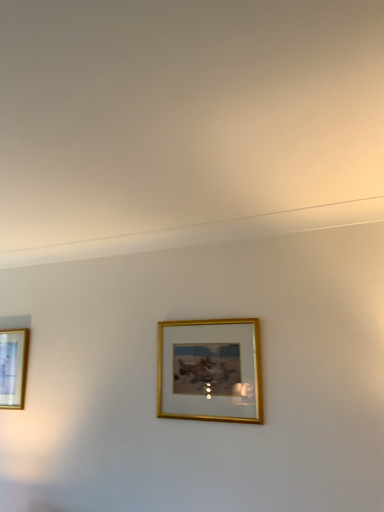
The height and width of the screenshot is (512, 384). In order to click on gold-framed picture at left, the 1th picture frame positioned from the back in this screenshot , I will do `click(13, 367)`.

What do you see at coordinates (13, 367) in the screenshot? I see `gold-framed picture at left, which is counted as the 2th picture frame, starting from the front` at bounding box center [13, 367].

The height and width of the screenshot is (512, 384). Describe the element at coordinates (210, 370) in the screenshot. I see `gold metallic picture frame at center, the 2th picture frame positioned from the left` at that location.

Locate an element on the screen. Image resolution: width=384 pixels, height=512 pixels. gold metallic picture frame at center, acting as the first picture frame starting from the right is located at coordinates (210, 370).

Where is `gold-framed picture at left, arranged as the first picture frame when viewed from the left`? The width and height of the screenshot is (384, 512). gold-framed picture at left, arranged as the first picture frame when viewed from the left is located at coordinates (13, 367).

Between gold metallic picture frame at center, acting as the first picture frame starting from the right, and gold-framed picture at left, the 1th picture frame positioned from the back, which one appears on the left side from the viewer's perspective?

From the viewer's perspective, gold-framed picture at left, the 1th picture frame positioned from the back, appears more on the left side.

Considering the positions of objects gold metallic picture frame at center, acting as the first picture frame starting from the right, and gold-framed picture at left, arranged as the first picture frame when viewed from the left, in the image provided, who is in front, gold metallic picture frame at center, acting as the first picture frame starting from the right, or gold-framed picture at left, arranged as the first picture frame when viewed from the left,?

gold metallic picture frame at center, acting as the first picture frame starting from the right, is in front.

Does point (223, 359) come farther from viewer compared to point (12, 342)?

No.

From the image's perspective, is gold metallic picture frame at center, placed as the first picture frame when sorted from front to back, located above or below gold-framed picture at left, the 1th picture frame positioned from the back?

Clearly, from the image's perspective, gold metallic picture frame at center, placed as the first picture frame when sorted from front to back, is above gold-framed picture at left, the 1th picture frame positioned from the back.

From a real-world perspective, between gold metallic picture frame at center, placed as the first picture frame when sorted from front to back, and gold-framed picture at left, which is counted as the 2th picture frame, starting from the front, who is vertically higher?

gold metallic picture frame at center, placed as the first picture frame when sorted from front to back, from a real-world perspective.

Considering the relative sizes of gold metallic picture frame at center, acting as the first picture frame starting from the right, and gold-framed picture at left, the 1th picture frame positioned from the back, in the image provided, is gold metallic picture frame at center, acting as the first picture frame starting from the right, thinner than gold-framed picture at left, the 1th picture frame positioned from the back,?

No.

Who is shorter, gold metallic picture frame at center, the 2th picture frame positioned from the left, or gold-framed picture at left, which is the second picture frame from right to left?

gold metallic picture frame at center, the 2th picture frame positioned from the left, is shorter.

In the scene shown: Does gold metallic picture frame at center, placed as the first picture frame when sorted from front to back, have a larger size compared to gold-framed picture at left, which is counted as the 2th picture frame, starting from the front?

Correct, gold metallic picture frame at center, placed as the first picture frame when sorted from front to back, is larger in size than gold-framed picture at left, which is counted as the 2th picture frame, starting from the front.

Can we say gold metallic picture frame at center, placed as the first picture frame when sorted from front to back, lies outside gold-framed picture at left, arranged as the first picture frame when viewed from the left?

gold metallic picture frame at center, placed as the first picture frame when sorted from front to back, lies outside gold-framed picture at left, arranged as the first picture frame when viewed from the left,'s area.

Looking at this image, are gold metallic picture frame at center, which is the second picture frame in back-to-front order, and gold-framed picture at left, the 1th picture frame positioned from the back, far apart?

Absolutely, gold metallic picture frame at center, which is the second picture frame in back-to-front order, is distant from gold-framed picture at left, the 1th picture frame positioned from the back.

Is gold metallic picture frame at center, placed as the first picture frame when sorted from front to back, turned away from gold-framed picture at left, arranged as the first picture frame when viewed from the left?

gold metallic picture frame at center, placed as the first picture frame when sorted from front to back, does not have its back to gold-framed picture at left, arranged as the first picture frame when viewed from the left.

How many degrees apart are the facing directions of gold metallic picture frame at center, placed as the first picture frame when sorted from front to back, and gold-framed picture at left, which is counted as the 2th picture frame, starting from the front?

The angular difference between gold metallic picture frame at center, placed as the first picture frame when sorted from front to back, and gold-framed picture at left, which is counted as the 2th picture frame, starting from the front, is 0.181 degrees.

Locate an element on the screen. The image size is (384, 512). picture frame below the gold metallic picture frame at center, placed as the first picture frame when sorted from front to back (from a real-world perspective) is located at coordinates (13, 367).

Is gold-framed picture at left, which is the second picture frame from right to left, at the left side of gold metallic picture frame at center, which is the second picture frame in back-to-front order?

Correct, you'll find gold-framed picture at left, which is the second picture frame from right to left, to the left of gold metallic picture frame at center, which is the second picture frame in back-to-front order.

Does gold-framed picture at left, the 1th picture frame positioned from the back, come behind gold metallic picture frame at center, placed as the first picture frame when sorted from front to back?

Yes, it is.

Which is closer, (16, 351) or (204, 325)?

Point (16, 351) is farther from the camera than point (204, 325).

From the image's perspective, is gold-framed picture at left, the 1th picture frame positioned from the back, on top of gold metallic picture frame at center, which is the second picture frame in back-to-front order?

Actually, gold-framed picture at left, the 1th picture frame positioned from the back, appears below gold metallic picture frame at center, which is the second picture frame in back-to-front order, in the image.

From a real-world perspective, between gold-framed picture at left, the 1th picture frame positioned from the back, and gold metallic picture frame at center, the 2th picture frame positioned from the left, who is vertically higher?

gold metallic picture frame at center, the 2th picture frame positioned from the left, from a real-world perspective.

Considering the sizes of objects gold-framed picture at left, arranged as the first picture frame when viewed from the left, and gold metallic picture frame at center, acting as the first picture frame starting from the right, in the image provided, who is wider, gold-framed picture at left, arranged as the first picture frame when viewed from the left, or gold metallic picture frame at center, acting as the first picture frame starting from the right,?

With larger width is gold metallic picture frame at center, acting as the first picture frame starting from the right.

Can you confirm if gold-framed picture at left, arranged as the first picture frame when viewed from the left, is shorter than gold metallic picture frame at center, placed as the first picture frame when sorted from front to back?

In fact, gold-framed picture at left, arranged as the first picture frame when viewed from the left, may be taller than gold metallic picture frame at center, placed as the first picture frame when sorted from front to back.

Looking at the image, does gold-framed picture at left, which is counted as the 2th picture frame, starting from the front, seem bigger or smaller compared to gold metallic picture frame at center, acting as the first picture frame starting from the right?

Clearly, gold-framed picture at left, which is counted as the 2th picture frame, starting from the front, is smaller in size than gold metallic picture frame at center, acting as the first picture frame starting from the right.

Is gold-framed picture at left, arranged as the first picture frame when viewed from the left, surrounding gold metallic picture frame at center, acting as the first picture frame starting from the right?

No, gold-framed picture at left, arranged as the first picture frame when viewed from the left, does not contain gold metallic picture frame at center, acting as the first picture frame starting from the right.

Is there a large distance between gold-framed picture at left, which is the second picture frame from right to left, and gold metallic picture frame at center, the 2th picture frame positioned from the left?

gold-framed picture at left, which is the second picture frame from right to left, is positioned a significant distance from gold metallic picture frame at center, the 2th picture frame positioned from the left.

Is gold-framed picture at left, which is the second picture frame from right to left, aimed at gold metallic picture frame at center, which is the second picture frame in back-to-front order?

No, gold-framed picture at left, which is the second picture frame from right to left, is not turned towards gold metallic picture frame at center, which is the second picture frame in back-to-front order.

Identify the location of picture frame lying on the left of gold metallic picture frame at center, which is the second picture frame in back-to-front order. Image resolution: width=384 pixels, height=512 pixels. (13, 367).

The width and height of the screenshot is (384, 512). Identify the location of picture frame above the gold-framed picture at left, which is counted as the 2th picture frame, starting from the front (from the image's perspective). (210, 370).

This screenshot has height=512, width=384. In order to click on picture frame in front of the gold-framed picture at left, which is the second picture frame from right to left in this screenshot , I will do `click(210, 370)`.